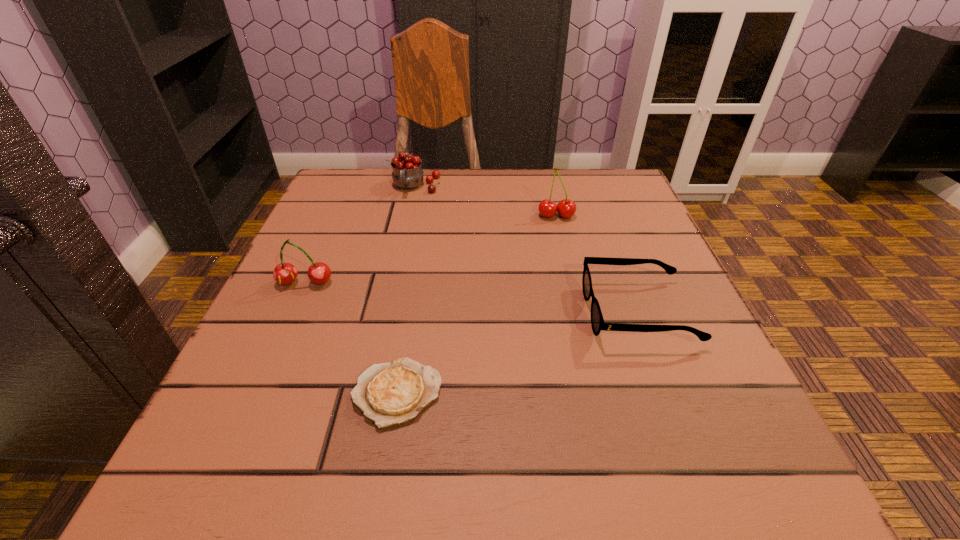
The height and width of the screenshot is (540, 960). Find the location of `free area in between the leftmost object and the nearest object`. free area in between the leftmost object and the nearest object is located at coordinates (351, 338).

Identify the location of vacant space in between the farthest object and the leftmost cherry. (361, 234).

At what (x,y) coordinates should I click in order to perform the action: click on free space that is in between the second nearest cherry and the leftmost cherry. Please return your answer as a coordinate pair (x, y). Looking at the image, I should click on (431, 249).

Image resolution: width=960 pixels, height=540 pixels. In order to click on unoccupied position between the rightmost cherry and the second cherry from left to right in this screenshot , I will do `click(486, 201)`.

You are a GUI agent. You are given a task and a screenshot of the screen. Output one action in this format:
    pyautogui.click(x=<x>, y=<y>)
    Task: Click on the vacant space that's between the spectacles and the farthest object
    
    Given the screenshot: What is the action you would take?
    pyautogui.click(x=527, y=249)

You are a GUI agent. You are given a task and a screenshot of the screen. Output one action in this format:
    pyautogui.click(x=<x>, y=<y>)
    Task: Click on the free spot between the nearest cherry and the fourth nearest object
    The height and width of the screenshot is (540, 960).
    Given the screenshot: What is the action you would take?
    pyautogui.click(x=431, y=249)

Locate which object is the fourth closest to the second farthest cherry. Please provide its 2D coordinates. Your answer should be formatted as a tuple, i.e. [(x, y)], where the tuple contains the x and y coordinates of a point satisfying the conditions above.

[(285, 273)]

Where is `object that is the closest to the leftmost object`? The height and width of the screenshot is (540, 960). object that is the closest to the leftmost object is located at coordinates (392, 393).

Identify which cherry is located as the second nearest to the farthest object. Please provide its 2D coordinates. Your answer should be formatted as a tuple, i.e. [(x, y)], where the tuple contains the x and y coordinates of a point satisfying the conditions above.

[(285, 273)]

At what (x,y) coordinates should I click in order to perform the action: click on cherry that can be found as the closest to the fourth nearest object. Please return your answer as a coordinate pair (x, y). Looking at the image, I should click on (407, 174).